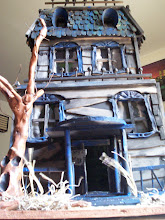
At what (x,y) coordinates should I click in order to perform the action: click on door. Please return your answer as a coordinate pair (x, y). The width and height of the screenshot is (165, 220). Looking at the image, I should click on (103, 173).